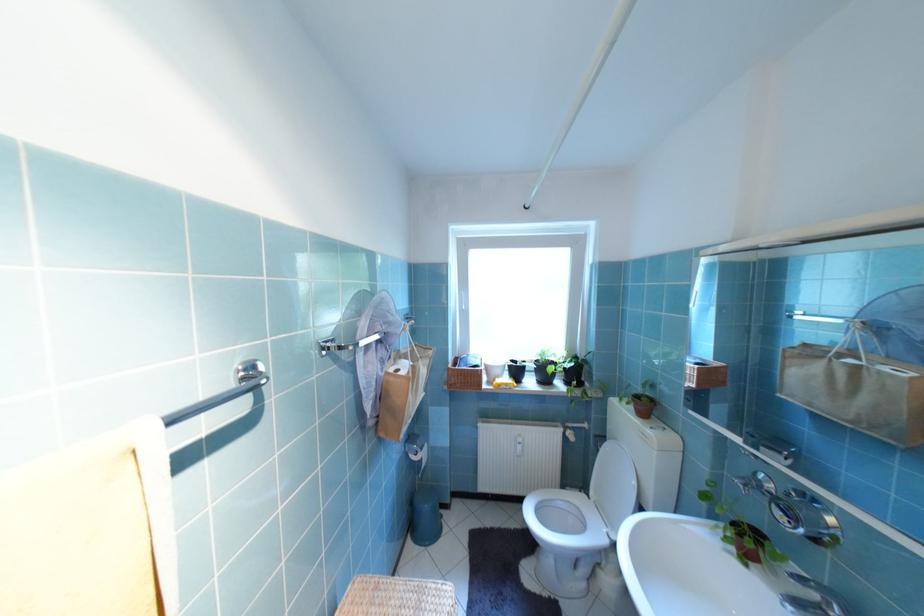
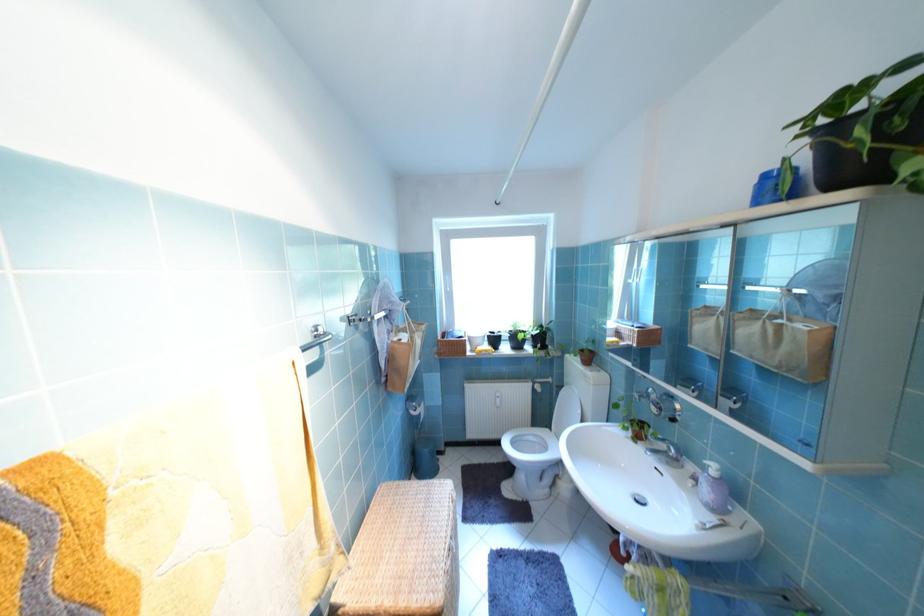
Question: How did the camera likely rotate?

Choices:
 (A) Left
 (B) Right
 (C) Up
 (D) Down

Answer: (B)